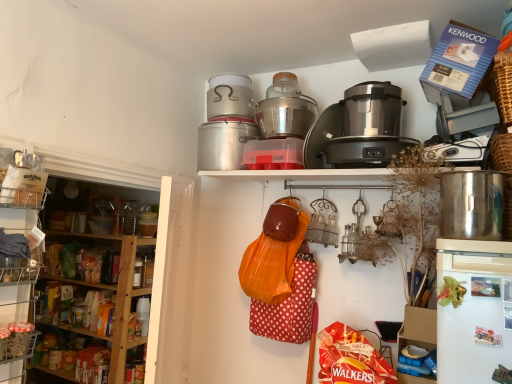
Question: Is brushed metal rice cooker at upper center, which appears as the 1th rice cooker when viewed from the left, positioned behind blue cardboard box at upper right, marked as the 3th appliance in a left-to-right arrangement?

Choices:
 (A) yes
 (B) no

Answer: (A)

Question: Is brushed metal rice cooker at upper center, which appears as the 1th rice cooker when viewed from the left, oriented towards blue cardboard box at upper right, the 1th appliance positioned from the right?

Choices:
 (A) no
 (B) yes

Answer: (A)

Question: Does brushed metal rice cooker at upper center, which appears as the 1th rice cooker when viewed from the left, come in front of blue cardboard box at upper right, the 1th appliance positioned from the right?

Choices:
 (A) no
 (B) yes

Answer: (A)

Question: From a real-world perspective, is brushed metal rice cooker at upper center, which ranks as the 3th rice cooker in right-to-left order, over blue cardboard box at upper right, the 1th appliance positioned from the right?

Choices:
 (A) no
 (B) yes

Answer: (B)

Question: Is brushed metal rice cooker at upper center, which appears as the 1th rice cooker when viewed from the left, to the right of blue cardboard box at upper right, marked as the 3th appliance in a left-to-right arrangement, from the viewer's perspective?

Choices:
 (A) no
 (B) yes

Answer: (A)

Question: Is black plastic food processor at upper center, acting as the first appliance starting from the left, situated inside silver metallic rice cooker at upper center, which is the 2th rice cooker from right to left, or outside?

Choices:
 (A) outside
 (B) inside

Answer: (A)

Question: Is black plastic food processor at upper center, arranged as the 3th appliance when viewed from the right, to the left or to the right of silver metallic rice cooker at upper center, the 2th rice cooker when ordered from left to right, in the image?

Choices:
 (A) right
 (B) left

Answer: (A)

Question: Based on their sizes in the image, would you say black plastic food processor at upper center, acting as the first appliance starting from the left, is bigger or smaller than silver metallic rice cooker at upper center, which is the 2th rice cooker from right to left?

Choices:
 (A) small
 (B) big

Answer: (A)

Question: In terms of height, does black plastic food processor at upper center, arranged as the 3th appliance when viewed from the right, look taller or shorter compared to silver metallic rice cooker at upper center, which is the 2th rice cooker from right to left?

Choices:
 (A) tall
 (B) short

Answer: (B)

Question: Would you say clear plastic basket at lower left, which appears as the first shelf when viewed from the left, is to the left or to the right of blue cardboard box at upper right, marked as the 3th appliance in a left-to-right arrangement, in the picture?

Choices:
 (A) right
 (B) left

Answer: (B)

Question: From the image's perspective, is clear plastic basket at lower left, acting as the 3th shelf starting from the right, positioned above or below blue cardboard box at upper right, marked as the 3th appliance in a left-to-right arrangement?

Choices:
 (A) below
 (B) above

Answer: (A)

Question: Is clear plastic basket at lower left, which appears as the first shelf when viewed from the left, bigger or smaller than blue cardboard box at upper right, marked as the 3th appliance in a left-to-right arrangement?

Choices:
 (A) small
 (B) big

Answer: (A)

Question: In terms of height, does clear plastic basket at lower left, which appears as the first shelf when viewed from the left, look taller or shorter compared to blue cardboard box at upper right, marked as the 3th appliance in a left-to-right arrangement?

Choices:
 (A) short
 (B) tall

Answer: (A)

Question: From their relative heights in the image, would you say silver metallic rice cooker at upper center, which is the 2th rice cooker from right to left, is taller or shorter than wooden shelves at left, which ranks as the second shelf in left-to-right order?

Choices:
 (A) tall
 (B) short

Answer: (B)

Question: From a real-world perspective, is silver metallic rice cooker at upper center, which is the 2th rice cooker from right to left, physically located above or below wooden shelves at left, which ranks as the second shelf in right-to-left order?

Choices:
 (A) below
 (B) above

Answer: (B)